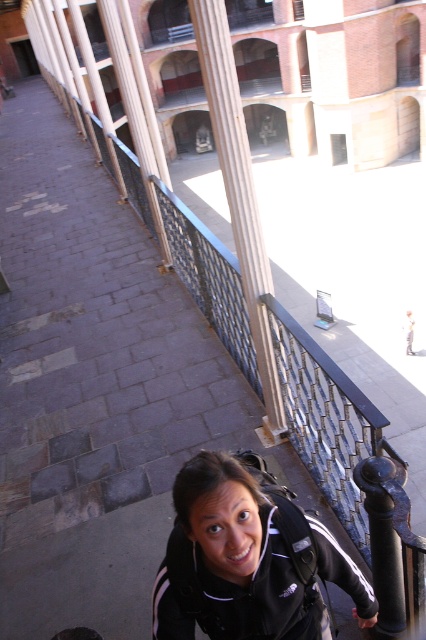
Based on the photo, does black fabric backpack at lower center lie behind white polished stone column at center?

No, it is in front of white polished stone column at center.

Is black fabric backpack at lower center below white polished stone column at center?

Correct, black fabric backpack at lower center is located below white polished stone column at center.

What do you see at coordinates (247, 560) in the screenshot? I see `black fabric backpack at lower center` at bounding box center [247, 560].

What are the coordinates of `black fabric backpack at lower center` in the screenshot? It's located at (247, 560).